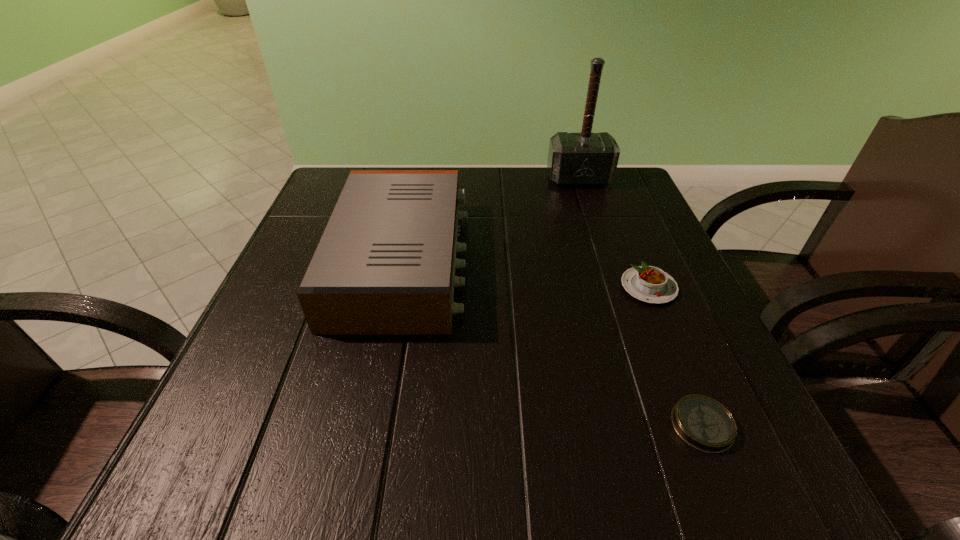
Locate an element on the screen. free location that satisfies the following two spatial constraints: 1. on the control panel of the second shortest object; 2. on the left side of the leftmost object is located at coordinates (397, 287).

The width and height of the screenshot is (960, 540). Find the location of `vacant space that satisfies the following two spatial constraints: 1. on the front side of the tallest object; 2. on the control panel of the leftmost object`. vacant space that satisfies the following two spatial constraints: 1. on the front side of the tallest object; 2. on the control panel of the leftmost object is located at coordinates (606, 260).

I want to click on vacant region that satisfies the following two spatial constraints: 1. on the control panel of the leftmost object; 2. on the left side of the pudding, so click(397, 287).

In order to click on blank area in the image that satisfies the following two spatial constraints: 1. on the control panel of the shortest object; 2. on the left side of the radio receiver in this screenshot , I will do click(x=370, y=425).

The height and width of the screenshot is (540, 960). What are the coordinates of `blank space that satisfies the following two spatial constraints: 1. on the control panel of the leftmost object; 2. on the right side of the nearest object` in the screenshot? It's located at (370, 425).

At what (x,y) coordinates should I click in order to perform the action: click on free spot that satisfies the following two spatial constraints: 1. on the front side of the farthest object; 2. on the control panel of the leftmost object. Please return your answer as a coordinate pair (x, y). Looking at the image, I should click on (606, 260).

The height and width of the screenshot is (540, 960). I want to click on blank space that satisfies the following two spatial constraints: 1. on the control panel of the leftmost object; 2. on the right side of the third tallest object, so click(397, 287).